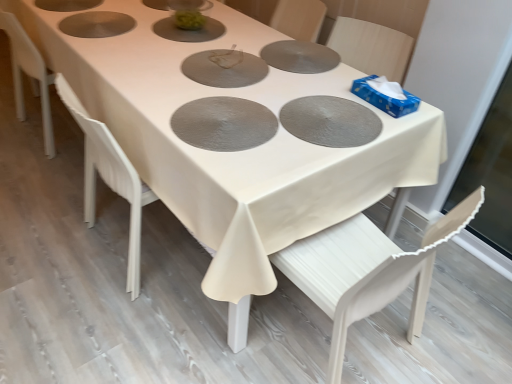
Where is `free spot behind matte gray pizza pan at center, which ranks as the 1th pizza pan in top-to-bottom order`? The height and width of the screenshot is (384, 512). free spot behind matte gray pizza pan at center, which ranks as the 1th pizza pan in top-to-bottom order is located at coordinates (229, 38).